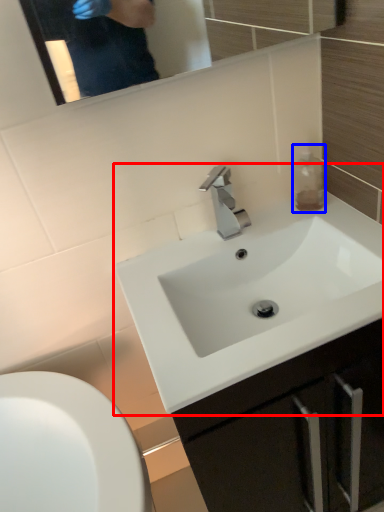
Question: Among these objects, which one is farthest to the camera, sink (highlighted by a red box) or bottle (highlighted by a blue box)?

Choices:
 (A) sink
 (B) bottle

Answer: (B)